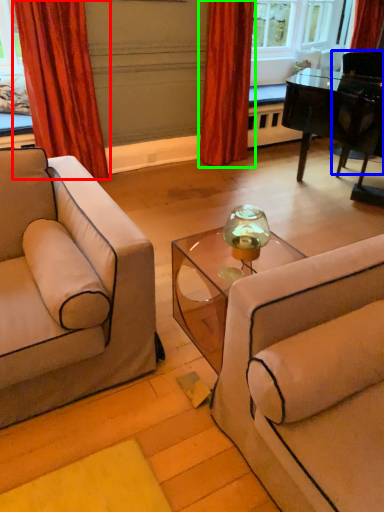
Question: Which object is the farthest from curtain (highlighted by a red box)? Choose among these: armchair (highlighted by a blue box) or curtain (highlighted by a green box).

Choices:
 (A) armchair
 (B) curtain

Answer: (A)